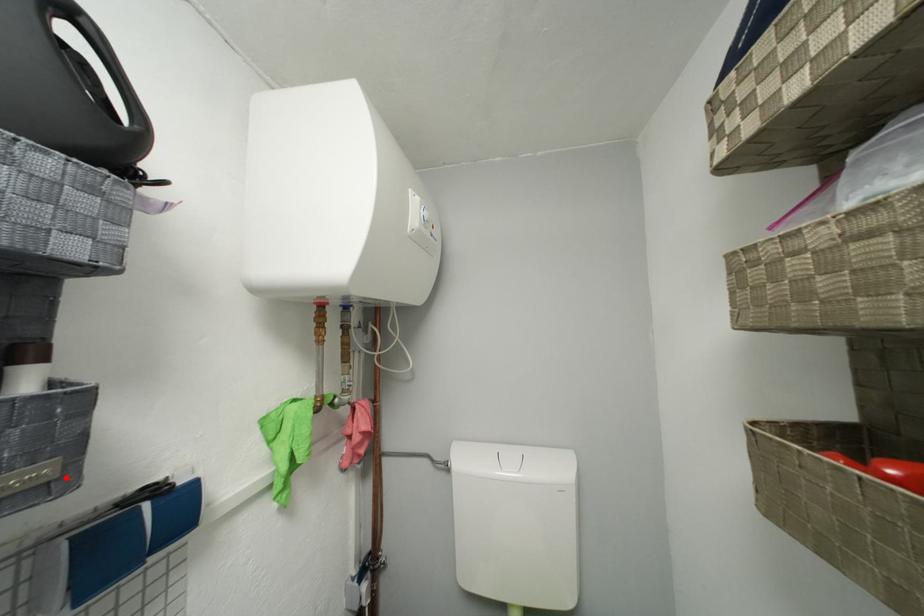
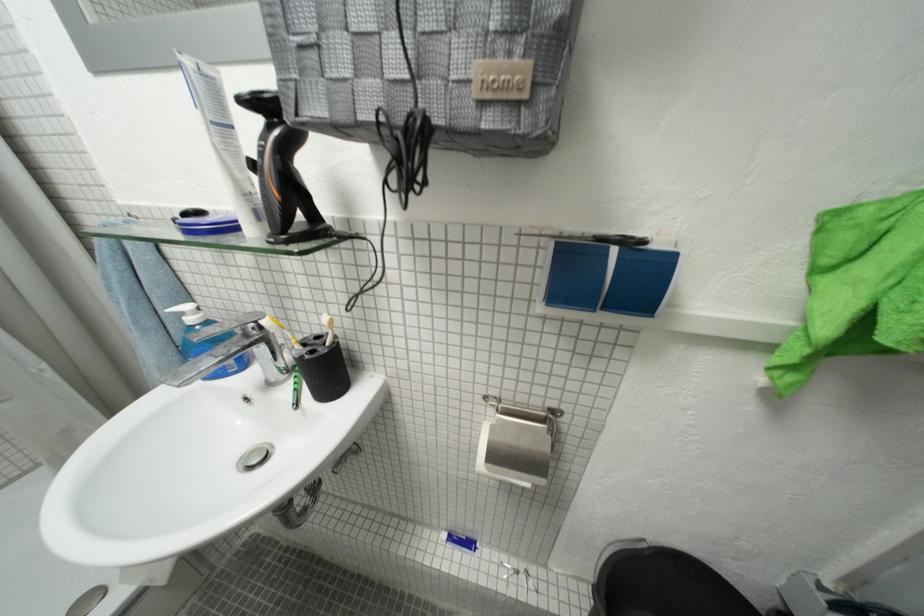
Find the pixel in the second image that matches the highlighted location in the first image.

(535, 98)